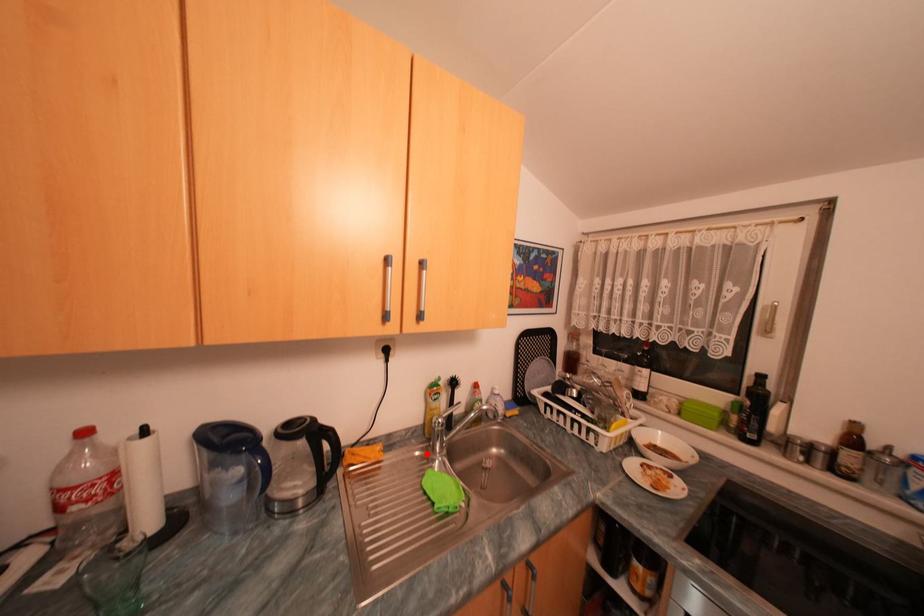
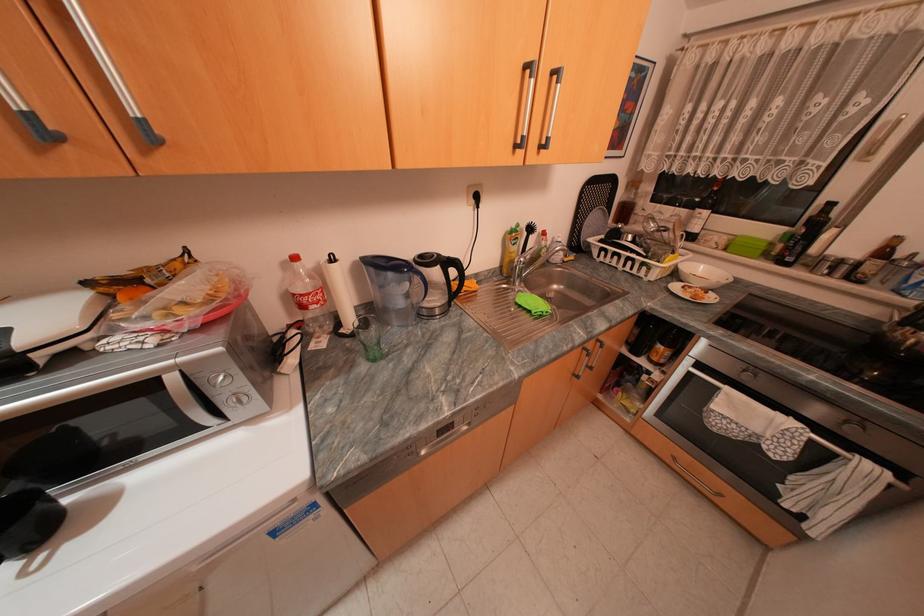
Locate, in the second image, the point that corresponds to the highlighted location in the first image.

(514, 285)